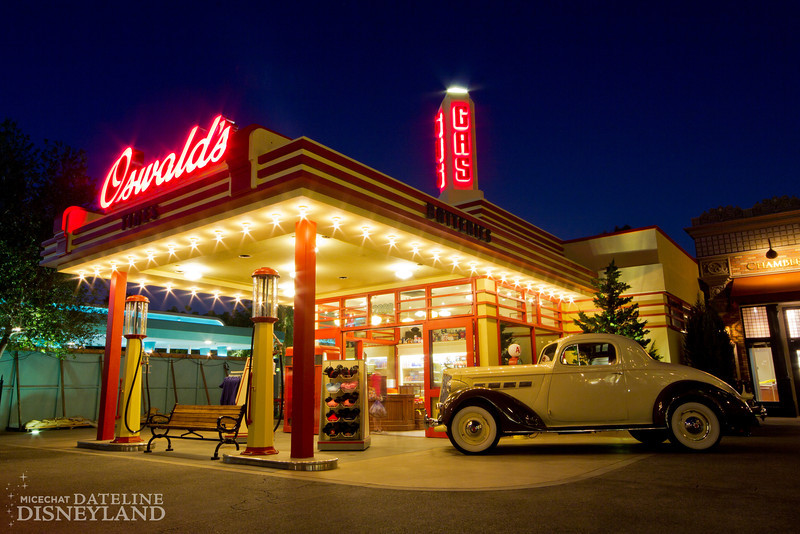
Find the location of `bench`. bench is located at coordinates (194, 426).